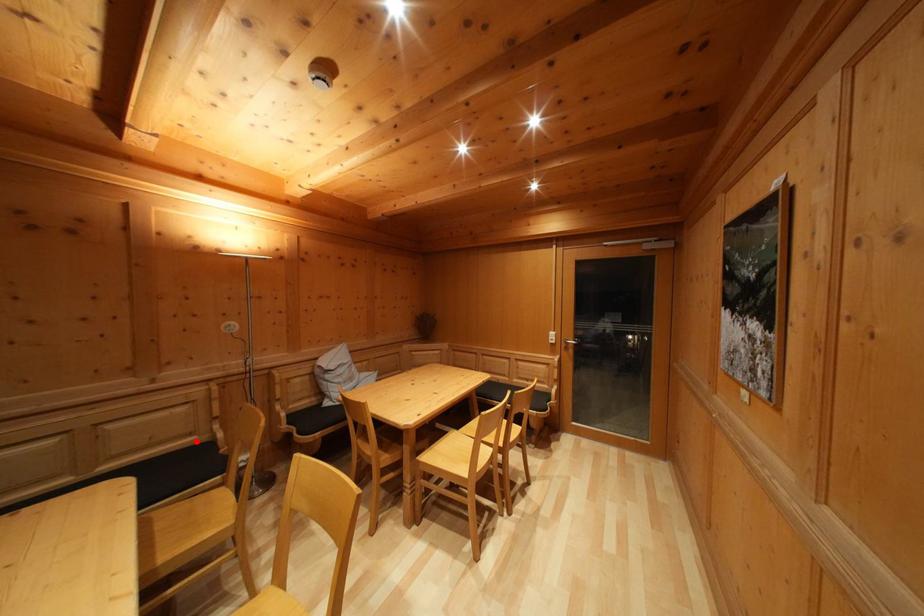
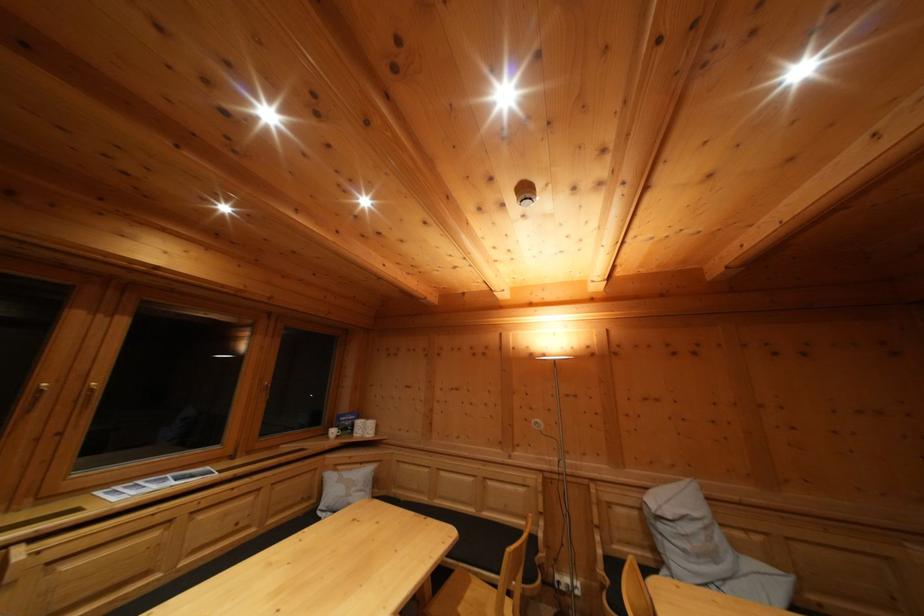
The point at the highlighted location is marked in the first image. Where is the corresponding point in the second image?

(532, 525)